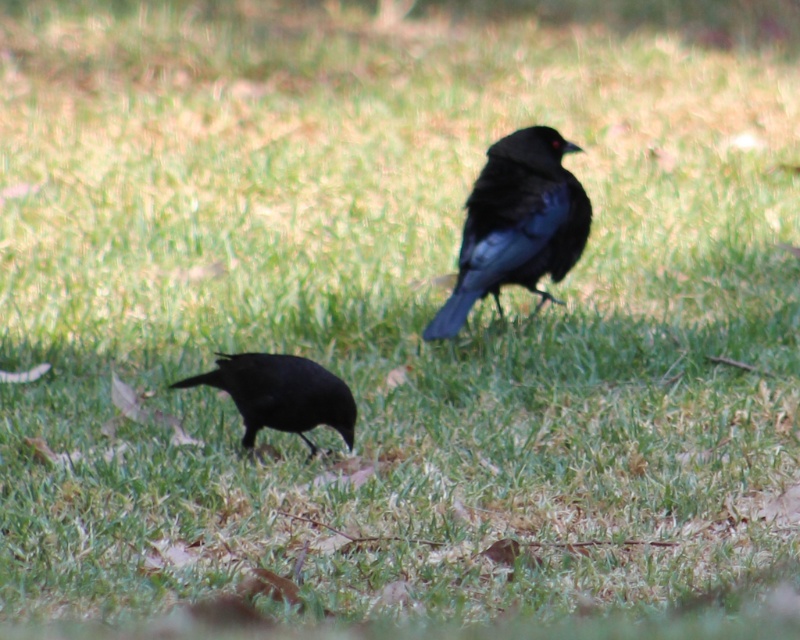
You are a photographer trying to capture both shiny black crow at upper right and shiny black crow at lower left in a single frame. Based on their positions, which direction should you move your camera to include both birds in the shot?

Since the shiny black crow at upper right is to the right of the shiny black crow at lower left, you should move your camera to the left to include both birds in the shot.

You are a photographer trying to capture both shiny black crow at upper right and shiny black crow at lower left in a single frame. Which crow should you focus on to ensure the larger one is in sharp focus?

You should focus on the shiny black crow at upper right because it is bigger than the shiny black crow at lower left, so it will require more precise focus to capture its details clearly.